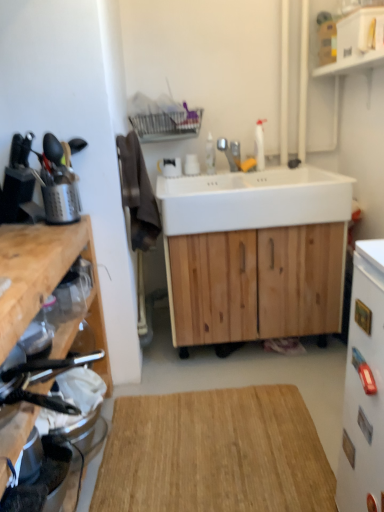
At what (x,y) coordinates should I click in order to perform the action: click on vacant space underneath natural wood cutting board at center (from a real-world perspective). Please return your answer as a coordinate pair (x, y). This screenshot has height=512, width=384. Looking at the image, I should click on (231, 454).